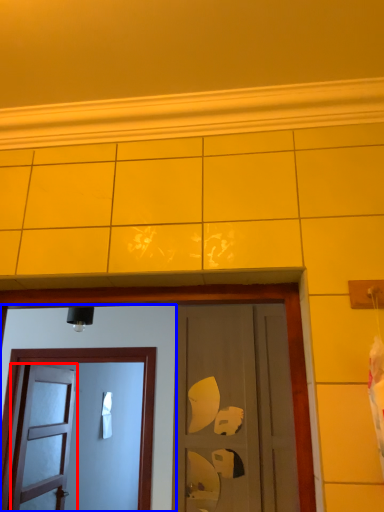
Question: Among these objects, which one is farthest to the camera, door (highlighted by a red box) or door (highlighted by a blue box)?

Choices:
 (A) door
 (B) door

Answer: (A)